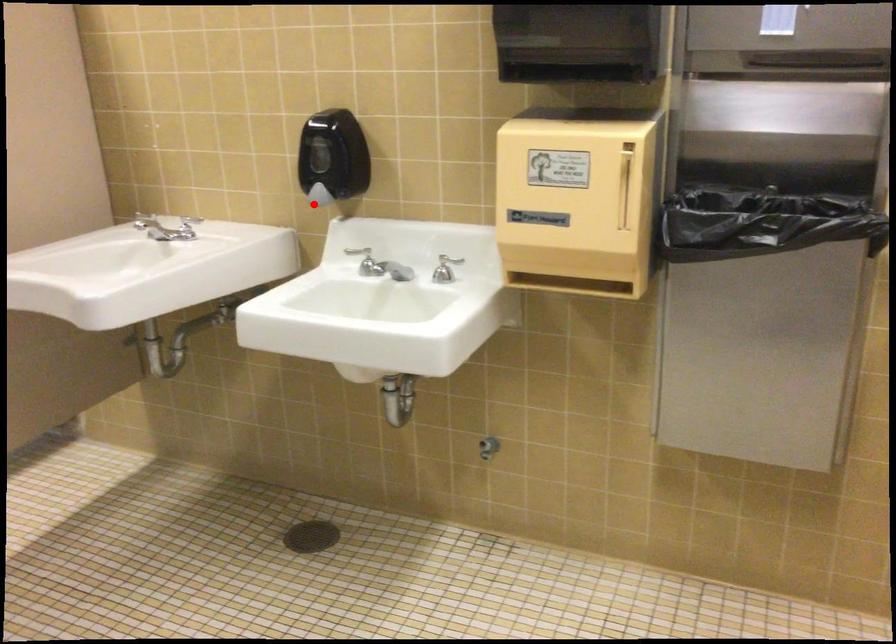
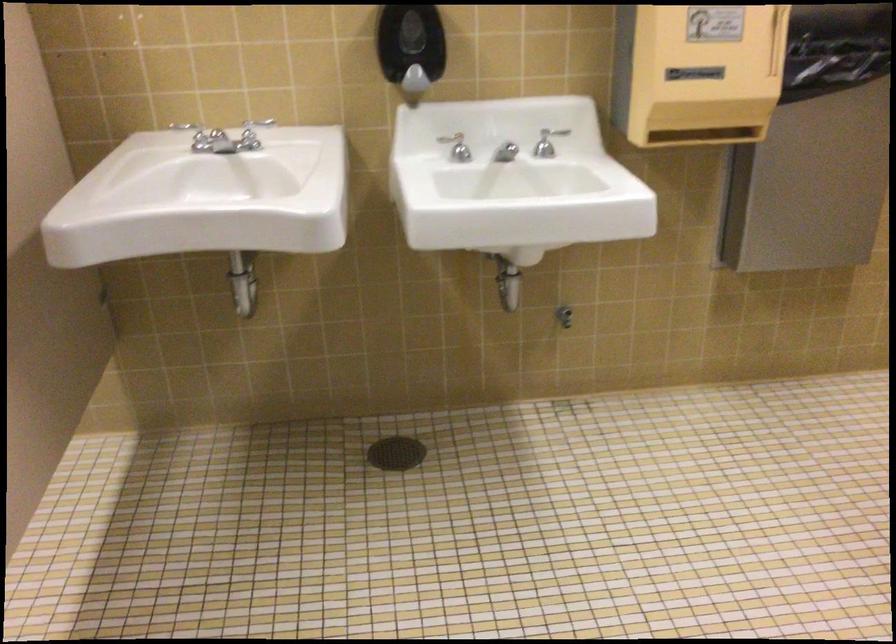
Question: I am providing you with two images of the same scene from different viewpoints. Given a red point in image1, look at the same physical point in image2. Is it:

Choices:
 (A) Closer to the viewpoint
 (B) Farther from the viewpoint

Answer: (A)